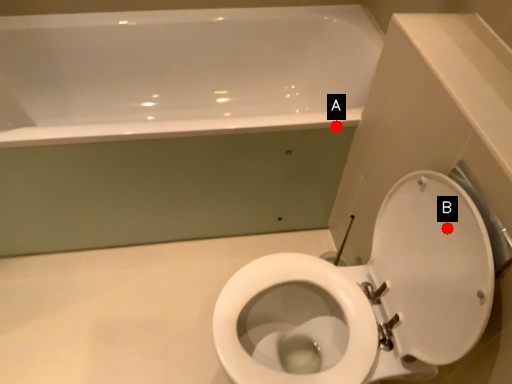
Question: Two points are circled on the image, labeled by A and B beside each circle. Which point appears farthest from the camera in this image?

Choices:
 (A) A is further
 (B) B is further

Answer: (A)